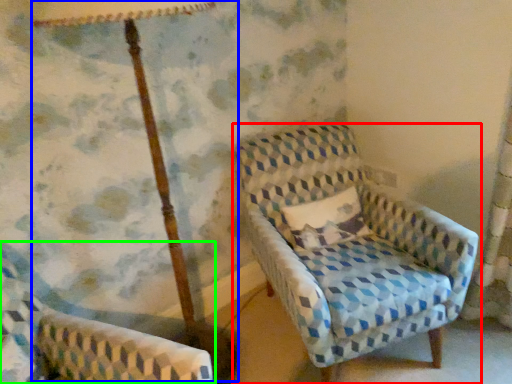
Question: Considering the real-world distances, which object is closest to chair (highlighted by a red box)? table lamp (highlighted by a blue box) or chair (highlighted by a green box).

Choices:
 (A) table lamp
 (B) chair

Answer: (A)